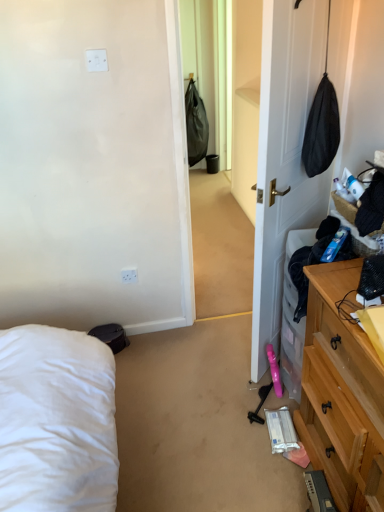
Question: Would you say light wood dresser at right is outside white plastic electric outlet at upper center?

Choices:
 (A) no
 (B) yes

Answer: (B)

Question: From a real-world perspective, is light wood dresser at right under white plastic electric outlet at upper center?

Choices:
 (A) yes
 (B) no

Answer: (B)

Question: From the image's perspective, is light wood dresser at right below white plastic electric outlet at upper center?

Choices:
 (A) no
 (B) yes

Answer: (B)

Question: Is light wood dresser at right oriented towards white plastic electric outlet at upper center?

Choices:
 (A) yes
 (B) no

Answer: (B)

Question: Is light wood dresser at right wider than white plastic electric outlet at upper center?

Choices:
 (A) yes
 (B) no

Answer: (A)

Question: Is white plastic electric outlet at upper center situated inside white matte door at center or outside?

Choices:
 (A) inside
 (B) outside

Answer: (B)

Question: From a real-world perspective, relative to white matte door at center, is white plastic electric outlet at upper center vertically above or below?

Choices:
 (A) below
 (B) above

Answer: (A)

Question: In the image, is white plastic electric outlet at upper center on the left side or the right side of white matte door at center?

Choices:
 (A) right
 (B) left

Answer: (B)

Question: In terms of height, does white plastic electric outlet at upper center look taller or shorter compared to white matte door at center?

Choices:
 (A) tall
 (B) short

Answer: (B)

Question: Does point (379, 413) appear closer or farther from the camera than point (137, 276)?

Choices:
 (A) closer
 (B) farther

Answer: (A)

Question: Considering their positions, is light wood dresser at right located in front of or behind white plastic electric outlet at upper center?

Choices:
 (A) behind
 (B) front

Answer: (B)

Question: Looking at their shapes, would you say light wood dresser at right is wider or thinner than white plastic electric outlet at upper center?

Choices:
 (A) wide
 (B) thin

Answer: (A)

Question: From a real-world perspective, is light wood dresser at right positioned above or below white plastic electric outlet at upper center?

Choices:
 (A) below
 (B) above

Answer: (B)

Question: Based on their positions, is white matte door at center located to the left or right of white plastic electric outlet at upper center?

Choices:
 (A) left
 (B) right

Answer: (B)

Question: From a real-world perspective, relative to white plastic electric outlet at upper center, is white matte door at center vertically above or below?

Choices:
 (A) below
 (B) above

Answer: (B)